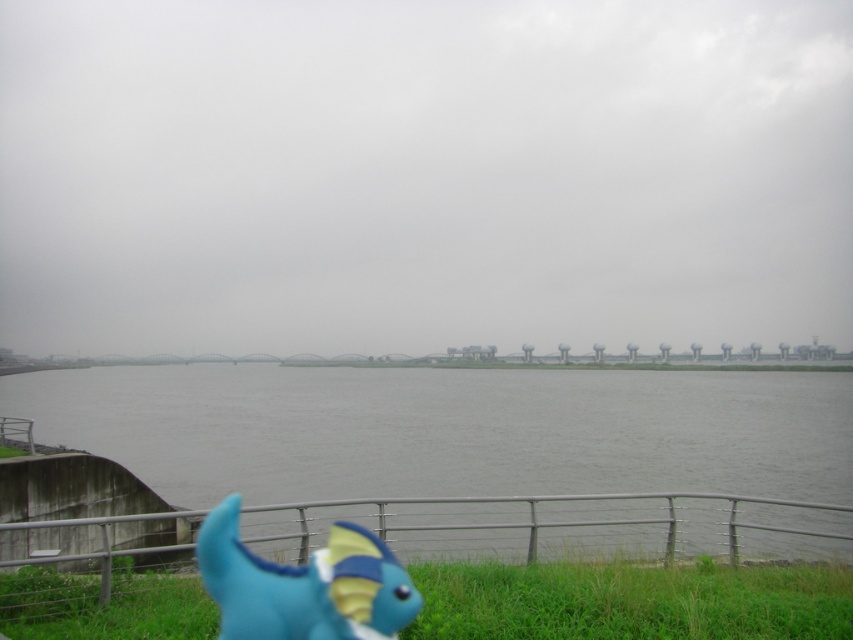
Question: Can you confirm if green grass at lower center is positioned below blue rubber toy at lower left?

Choices:
 (A) yes
 (B) no

Answer: (B)

Question: Can you confirm if gray concrete lake at center is positioned to the left of blue rubber toy at lower left?

Choices:
 (A) yes
 (B) no

Answer: (A)

Question: Which of the following is the closest to the observer?

Choices:
 (A) gray concrete lake at center
 (B) blue rubber toy at lower left

Answer: (B)

Question: Is the position of gray concrete lake at center more distant than that of green grass at lower center?

Choices:
 (A) no
 (B) yes

Answer: (B)

Question: Based on their relative distances, which object is nearer to the green grass at lower center?

Choices:
 (A) gray concrete lake at center
 (B) blue rubber toy at lower left

Answer: (B)

Question: Which of the following is the farthest from the observer?

Choices:
 (A) gray concrete lake at center
 (B) blue rubber toy at lower left
 (C) green grass at lower center

Answer: (A)